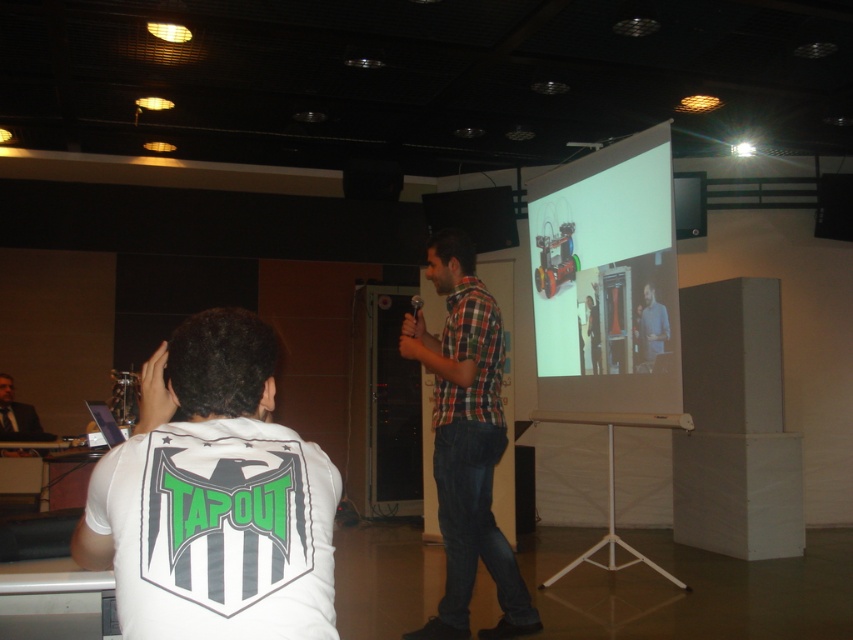
You are attending a presentation in a conference room and notice two people in the front row. One is wearing a white matte shirt at lower left, and the other is wearing a matte blue shirt at center. Which person is sitting closer to the front of the room?

The white matte shirt at lower left is closer to the viewer than the matte blue shirt at center, so the person wearing the white matte shirt at lower left is sitting closer to the front of the room.

In the scene shown: You are a guest at the presentation and want to take a photo of the screen and the presenter. Since you are standing behind the matte blue shirt at center, can you see the white matte projection screen at upper right clearly?

The white matte projection screen at upper right is located above the matte blue shirt at center, so yes, you can see it clearly as it is positioned above the obstruction.